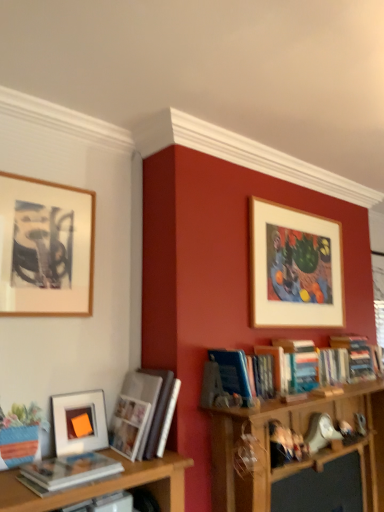
I want to click on free spot above matte white book at lower left, which ranks as the fifth book in right-to-left order (from a real-world perspective), so click(x=69, y=466).